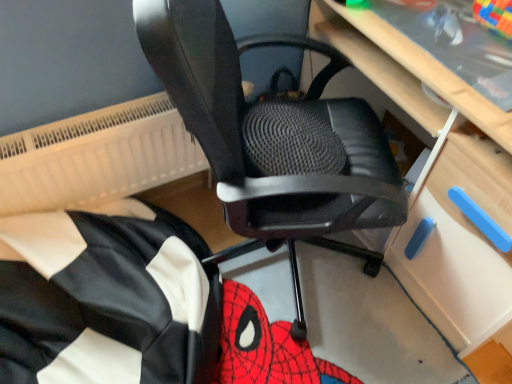
Question: Is light wood computer desk at center at the back of white textured radiator at upper left?

Choices:
 (A) yes
 (B) no

Answer: (B)

Question: Is white textured radiator at upper left outside of light wood computer desk at center?

Choices:
 (A) yes
 (B) no

Answer: (A)

Question: Could you tell me if white textured radiator at upper left is turned towards light wood computer desk at center?

Choices:
 (A) no
 (B) yes

Answer: (A)

Question: Is white textured radiator at upper left shorter than light wood computer desk at center?

Choices:
 (A) no
 (B) yes

Answer: (B)

Question: Does white textured radiator at upper left have a lesser width compared to light wood computer desk at center?

Choices:
 (A) yes
 (B) no

Answer: (A)

Question: Is white textured radiator at upper left wider than light wood computer desk at center?

Choices:
 (A) no
 (B) yes

Answer: (A)

Question: From the image's perspective, does black mesh office chair at center appear higher than black fabric bean bag at lower left?

Choices:
 (A) yes
 (B) no

Answer: (A)

Question: Is black mesh office chair at center smaller than black fabric bean bag at lower left?

Choices:
 (A) no
 (B) yes

Answer: (A)

Question: Is black mesh office chair at center completely or partially outside of black fabric bean bag at lower left?

Choices:
 (A) yes
 (B) no

Answer: (A)

Question: Is black mesh office chair at center aimed at black fabric bean bag at lower left?

Choices:
 (A) no
 (B) yes

Answer: (A)

Question: Considering the relative positions of black mesh office chair at center and black fabric bean bag at lower left in the image provided, is black mesh office chair at center behind black fabric bean bag at lower left?

Choices:
 (A) no
 (B) yes

Answer: (A)

Question: From a real-world perspective, is black mesh office chair at center over black fabric bean bag at lower left?

Choices:
 (A) no
 (B) yes

Answer: (B)

Question: Is light wood computer desk at center oriented towards black mesh office chair at center?

Choices:
 (A) no
 (B) yes

Answer: (B)